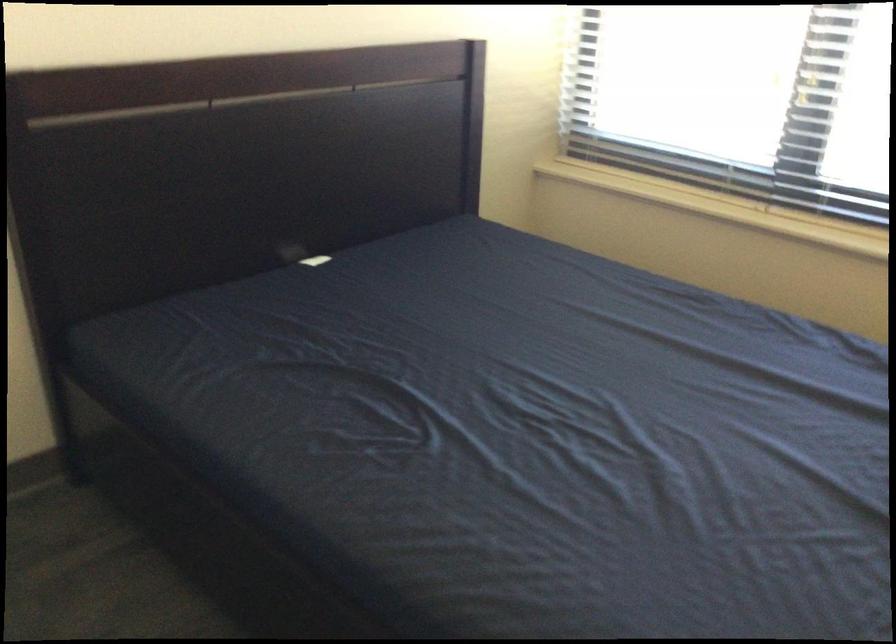
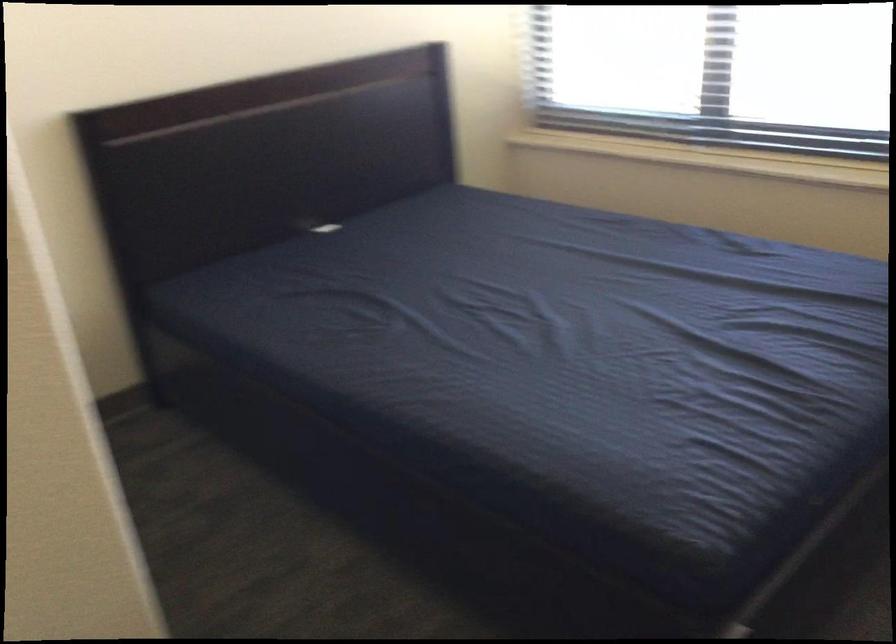
What movement of the cameraman would produce the second image?

The movement direction of the cameraman is right, backward.